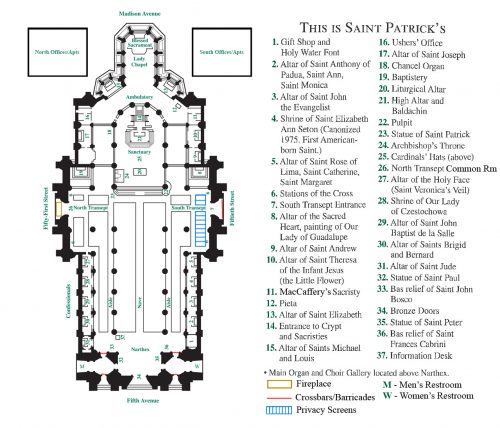
At what (x,y) coordinates should I click in order to perform the action: click on altar. Please return your answer as a coordinate pair (x, y). Looking at the image, I should click on (113, 89).